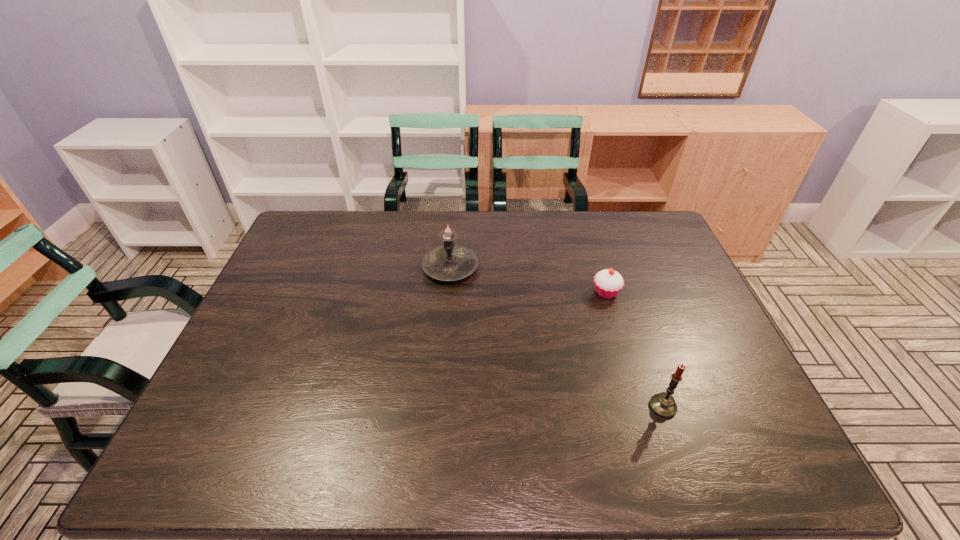
I want to click on vacant space at the near edge, so click(496, 450).

In order to click on vacant region at the left edge of the desktop in this screenshot , I will do tap(299, 293).

You are a GUI agent. You are given a task and a screenshot of the screen. Output one action in this format:
    pyautogui.click(x=<x>, y=<y>)
    Task: Click on the vacant area at the right edge
    This screenshot has width=960, height=540.
    Given the screenshot: What is the action you would take?
    pyautogui.click(x=634, y=267)

I want to click on vacant space at the near left corner of the desktop, so click(x=174, y=475).

Find the location of a particular element. This screenshot has width=960, height=540. free space at the far right corner of the desktop is located at coordinates (628, 241).

Identify the location of vacant area that lies between the cupcake and the right candle. This screenshot has height=540, width=960. (635, 349).

This screenshot has height=540, width=960. Find the location of `unoccupied area between the nearest object and the farther candle`. unoccupied area between the nearest object and the farther candle is located at coordinates (557, 338).

What are the coordinates of `vacant area between the farther candle and the nearer candle` in the screenshot? It's located at (557, 338).

At what (x,y) coordinates should I click in order to perform the action: click on free space between the nearest object and the leftmost object. Please return your answer as a coordinate pair (x, y). The height and width of the screenshot is (540, 960). Looking at the image, I should click on pos(557,338).

Identify the location of empty space between the nearer candle and the shortest object. The image size is (960, 540). (635, 349).